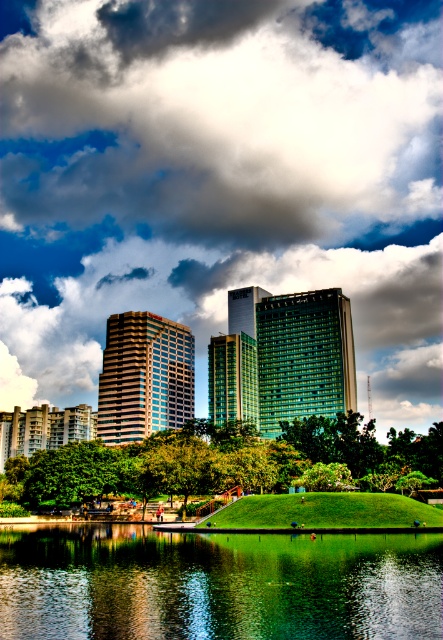
From the picture: Does cloudy sky at upper center appear over green reflective water at center?

Yes, cloudy sky at upper center is above green reflective water at center.

Which is behind, point (338, 236) or point (264, 564)?

Positioned behind is point (338, 236).

The width and height of the screenshot is (443, 640). I want to click on cloudy sky at upper center, so click(x=221, y=116).

Is cloudy sky at upper center shorter than green leafy tree at center?

In fact, cloudy sky at upper center may be taller than green leafy tree at center.

Is cloudy sky at upper center further to the viewer compared to green leafy tree at center?

Yes, it is.

Between point (245, 172) and point (354, 448), which one is positioned behind?

Point (245, 172)

Image resolution: width=443 pixels, height=640 pixels. What are the coordinates of `cloudy sky at upper center` in the screenshot? It's located at 221,116.

I want to click on green reflective water at center, so click(x=217, y=584).

Does green reflective water at center lie in front of green leafy tree at center?

Yes.

Does point (397, 637) come in front of point (77, 458)?

Yes.

Locate an element on the screen. The height and width of the screenshot is (640, 443). green reflective water at center is located at coordinates (217, 584).